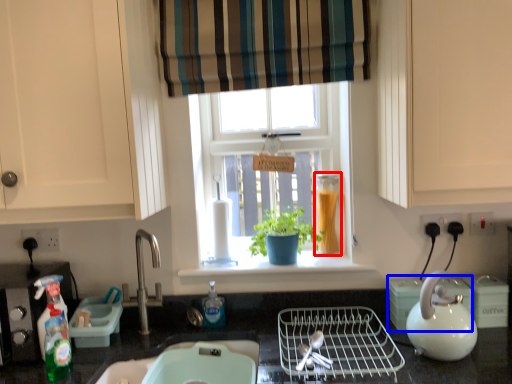
Question: Which object appears farthest to the camera in this image, glass jar (highlighted by a red box) or appliance (highlighted by a blue box)?

Choices:
 (A) glass jar
 (B) appliance

Answer: (A)